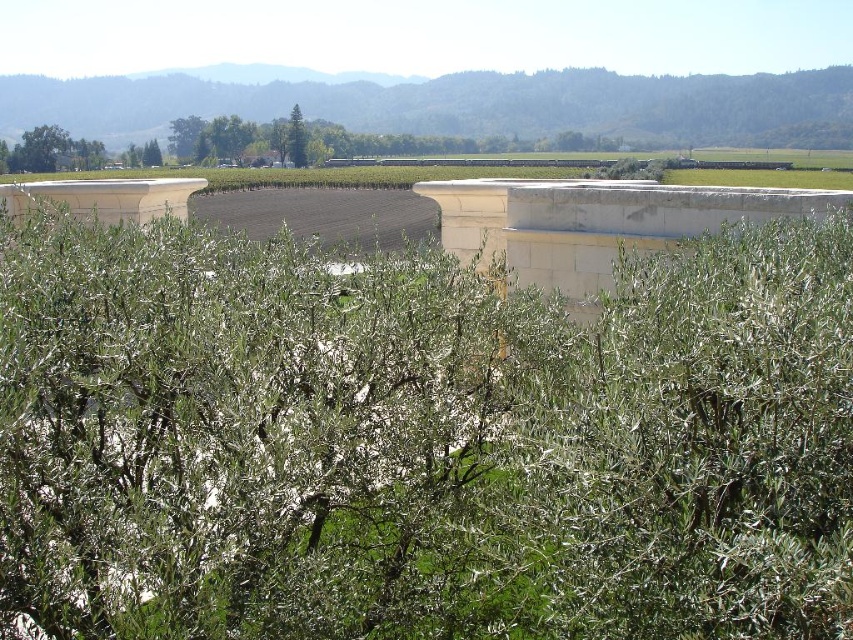
Question: Does green leafy tree at center appear on the left side of green leafy tree at upper center?

Choices:
 (A) yes
 (B) no

Answer: (B)

Question: Can you confirm if green leafy tree at center is positioned above green leafy tree at upper center?

Choices:
 (A) no
 (B) yes

Answer: (B)

Question: Which point appears farthest from the camera in this image?

Choices:
 (A) (305, 128)
 (B) (143, 156)

Answer: (A)

Question: Is green leafy tree at center further to camera compared to green leafy tree at upper center?

Choices:
 (A) no
 (B) yes

Answer: (A)

Question: Among these objects, which one is nearest to the camera?

Choices:
 (A) green leafy tree at upper center
 (B) green leafy tree at center

Answer: (B)